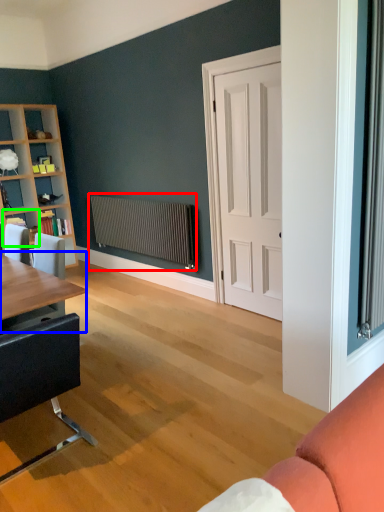
Question: Based on their relative distances, which object is farther from radiator (highlighted by a red box)? Choose from table (highlighted by a blue box) and shelf (highlighted by a green box).

Choices:
 (A) table
 (B) shelf

Answer: (A)